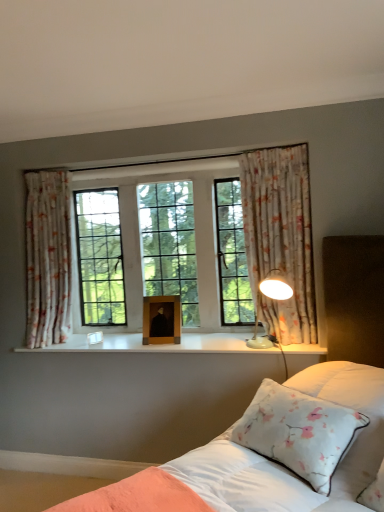
From the picture: What is the approximate height of wooden picture frame at center?

wooden picture frame at center is 13.77 inches in height.

Based on the photo, what is the approximate height of white satin bed at center?

It is 1.58 meters.

I want to click on white floral pillow at lower right, so click(299, 432).

Is white floral pillow at lower right oriented towards white glossy wood at center?

No, white floral pillow at lower right is not oriented towards white glossy wood at center.

Is white floral pillow at lower right not inside white glossy wood at center?

Absolutely, white floral pillow at lower right is external to white glossy wood at center.

Can you confirm if white floral pillow at lower right is shorter than white glossy wood at center?

Incorrect, the height of white floral pillow at lower right does not fall short of that of white glossy wood at center.

The image size is (384, 512). In order to click on picture frame below the floral fabric curtain at right, which ranks as the 2th curtain in back-to-front order (from the image's perspective) in this screenshot , I will do `click(164, 317)`.

Is floral fabric curtain at right, the first curtain when ordered from front to back, wider than wooden picture frame at center?

Yes, floral fabric curtain at right, the first curtain when ordered from front to back, is wider than wooden picture frame at center.

Does point (289, 189) come in front of point (166, 339)?

Yes, point (289, 189) is closer to viewer.

Considering the sizes of objects floral fabric curtain at right, positioned as the 1th curtain in right-to-left order, and wooden picture frame at center in the image provided, who is shorter, floral fabric curtain at right, positioned as the 1th curtain in right-to-left order, or wooden picture frame at center?

Standing shorter between the two is wooden picture frame at center.

Can you tell me how much white floral pillow at lower right and white satin bed at center differ in facing direction?

They differ by 0.000476 degrees in their facing directions.

Considering the relative sizes of white floral pillow at lower right and white satin bed at center in the image provided, is white floral pillow at lower right bigger than white satin bed at center?

No, white floral pillow at lower right is not bigger than white satin bed at center.

Which is more to the left, white floral pillow at lower right or white satin bed at center?

white satin bed at center.

Is point (267, 454) closer or farther from the camera than point (180, 482)?

Point (267, 454) appears to be farther away from the viewer than point (180, 482).

Does floral fabric curtain at right, which ranks as the 2th curtain in back-to-front order, have a larger size compared to white glossy table lamp at right?

Yes.

Is floral fabric curtain at right, which ranks as the 2th curtain in back-to-front order, wider than white glossy table lamp at right?

Incorrect, the width of floral fabric curtain at right, which ranks as the 2th curtain in back-to-front order, does not surpass that of white glossy table lamp at right.

Which is more to the right, floral fabric curtain at right, positioned as the 2th curtain in left-to-right order, or white glossy table lamp at right?

Positioned to the right is floral fabric curtain at right, positioned as the 2th curtain in left-to-right order.

Does white satin bed at center contain white glossy table lamp at right?

No, white satin bed at center does not contain white glossy table lamp at right.

Does white satin bed at center have a larger size compared to white glossy table lamp at right?

Yes, white satin bed at center is bigger than white glossy table lamp at right.

From their relative heights in the image, would you say white satin bed at center is taller or shorter than white glossy table lamp at right?

In the image, white satin bed at center appears to be taller than white glossy table lamp at right.

Who is more distant, white satin bed at center or white glossy table lamp at right?

white glossy table lamp at right is more distant.

Is white floral pillow at lower right next to wooden picture frame at center and touching it?

No, white floral pillow at lower right is not touching wooden picture frame at center.

Which of these two, white floral pillow at lower right or wooden picture frame at center, stands taller?

white floral pillow at lower right is taller.

Is white floral pillow at lower right to the left or to the right of wooden picture frame at center in the image?

Clearly, white floral pillow at lower right is on the right of wooden picture frame at center in the image.

Based on the photo, who is shorter, white glossy wood at center or white floral pillow at lower right?

white glossy wood at center.

Based on the photo, which object is closer to the camera taking this photo, white glossy wood at center or white floral pillow at lower right?

white floral pillow at lower right is more forward.

Does point (222, 334) appear closer or farther from the camera than point (266, 455)?

Point (222, 334) is farther from the camera than point (266, 455).

Locate an element on the screen. Image resolution: width=384 pixels, height=512 pixels. window sill to the left of white floral pillow at lower right is located at coordinates (157, 344).

Identify the location of picture frame behind the floral fabric curtain at right, positioned as the 2th curtain in left-to-right order. Image resolution: width=384 pixels, height=512 pixels. (164, 317).

Estimate the real-world distances between objects in this image. Which object is further from white floral pillow at lower right, white satin bed at center or floral fabric curtain at left, placed as the 1th curtain when sorted from left to right?

floral fabric curtain at left, placed as the 1th curtain when sorted from left to right, lies further to white floral pillow at lower right than the other object.

Estimate the real-world distances between objects in this image. Which object is closer to wooden picture frame at center, white glossy wood at center or white glossy table lamp at right?

white glossy wood at center.

Considering their positions, is floral fabric curtain at right, which ranks as the 2th curtain in back-to-front order, positioned further to white floral pillow at lower right than white satin bed at center?

floral fabric curtain at right, which ranks as the 2th curtain in back-to-front order, is positioned further to the anchor white floral pillow at lower right.

From the image, which object appears to be farther from floral fabric curtain at right, positioned as the 2th curtain in left-to-right order, wooden picture frame at center or white glossy table lamp at right?

wooden picture frame at center.

Which object lies nearer to the anchor point white floral pillow at lower right, floral fabric curtain at left, which is the second curtain in front-to-back order, or white satin bed at center?

white satin bed at center.

Looking at the image, which one is located further to floral fabric curtain at right, positioned as the 2th curtain in left-to-right order, floral fabric curtain at left, which is the second curtain in front-to-back order, or white satin bed at center?

floral fabric curtain at left, which is the second curtain in front-to-back order, lies further to floral fabric curtain at right, positioned as the 2th curtain in left-to-right order, than the other object.

When comparing their distances from wooden picture frame at center, does white glossy table lamp at right or white satin bed at center seem further?

white satin bed at center is further to wooden picture frame at center.

When comparing their distances from white satin bed at center, does wooden picture frame at center or floral fabric curtain at right, which ranks as the 2th curtain in back-to-front order, seem further?

wooden picture frame at center is positioned further to the anchor white satin bed at center.

The image size is (384, 512). I want to click on pillow situated between floral fabric curtain at left, placed as the first curtain when sorted from back to front, and white glossy table lamp at right from left to right, so click(x=299, y=432).

Locate an element on the screen. Image resolution: width=384 pixels, height=512 pixels. curtain between white floral pillow at lower right and wooden picture frame at center in the front-back direction is located at coordinates (280, 237).

Image resolution: width=384 pixels, height=512 pixels. Find the location of `window sill between white floral pillow at lower right and floral fabric curtain at right, positioned as the 2th curtain in left-to-right order, along the z-axis`. window sill between white floral pillow at lower right and floral fabric curtain at right, positioned as the 2th curtain in left-to-right order, along the z-axis is located at coordinates (157, 344).

The height and width of the screenshot is (512, 384). In order to click on window sill situated between wooden picture frame at center and floral fabric curtain at right, which ranks as the 2th curtain in back-to-front order, from left to right in this screenshot , I will do `click(157, 344)`.